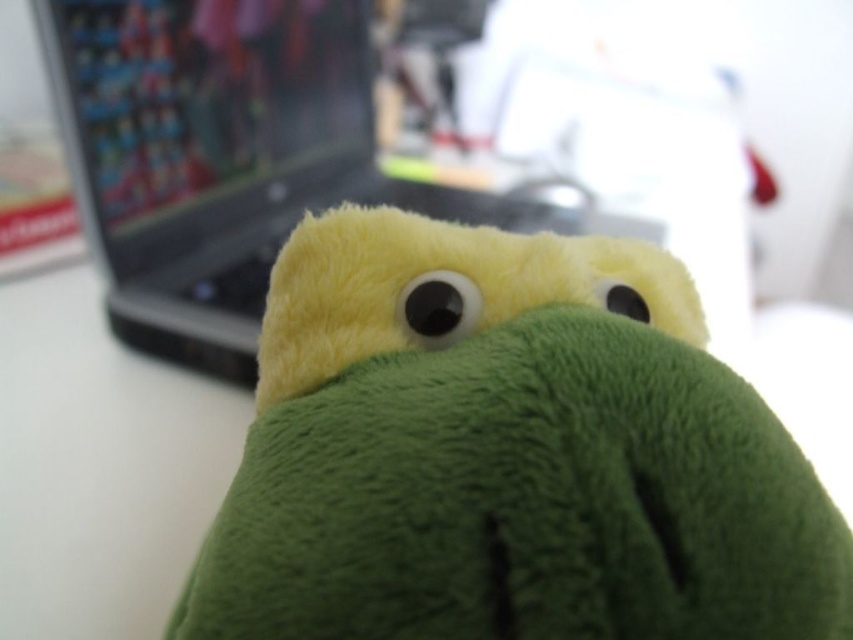
Question: Can you confirm if green fuzzy plush toy at center is positioned below silver metallic laptop at center?

Choices:
 (A) no
 (B) yes

Answer: (B)

Question: Is green fuzzy plush toy at center closer to camera compared to silver metallic laptop at center?

Choices:
 (A) yes
 (B) no

Answer: (A)

Question: Which point is closer to the camera taking this photo?

Choices:
 (A) (514, 244)
 (B) (199, 280)

Answer: (A)

Question: Observing the image, what is the correct spatial positioning of green fuzzy plush toy at center in reference to silver metallic laptop at center?

Choices:
 (A) right
 (B) left

Answer: (A)